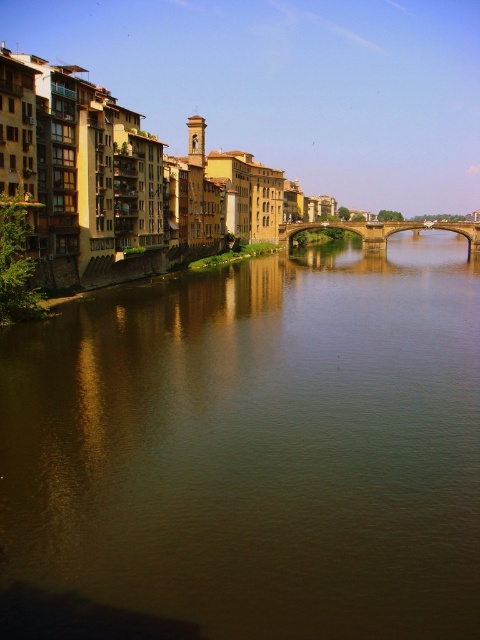
Which is above, brown reflective water at center or stone arch bridge at center?

Positioned higher is stone arch bridge at center.

Can you confirm if brown reflective water at center is positioned below stone arch bridge at center?

Correct, brown reflective water at center is located below stone arch bridge at center.

Does point (82, 616) lie behind point (452, 230)?

No.

This screenshot has height=640, width=480. Identify the location of brown reflective water at center. (249, 452).